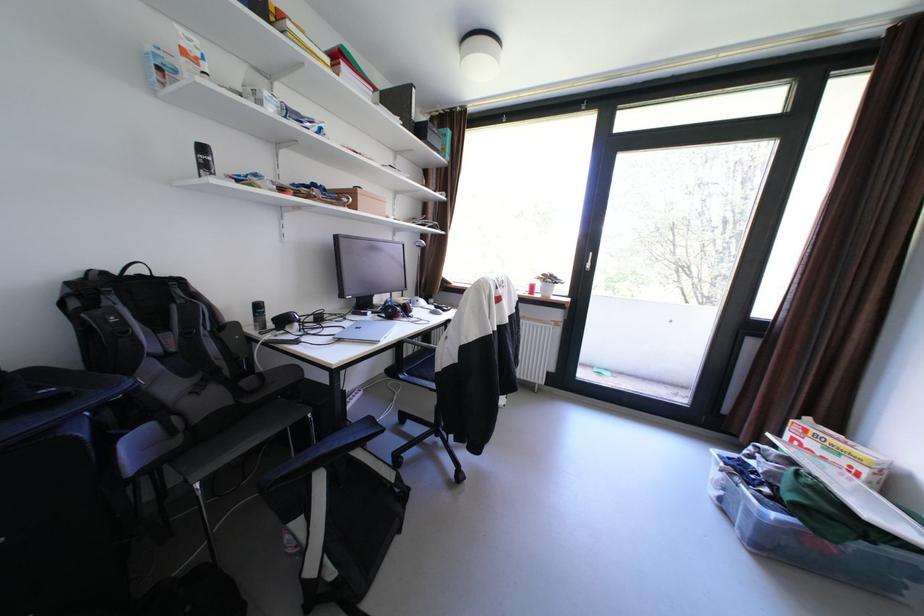
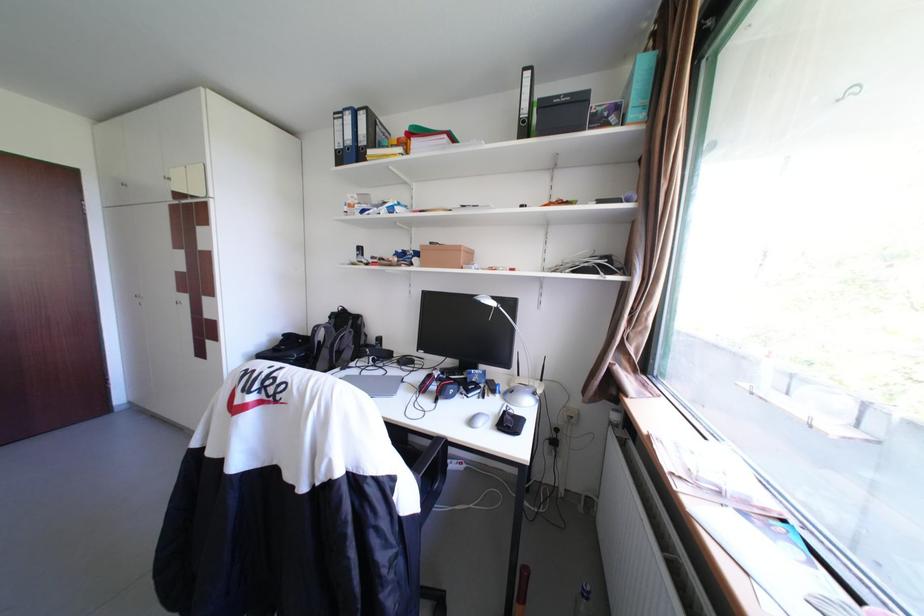
Find the pixel in the second image that matches pixel 123 299 in the first image.

(344, 321)